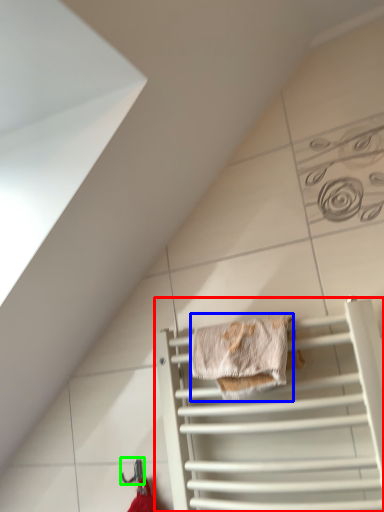
Question: Considering the real-world distances, which object is closest to cage (highlighted by a red box)? material (highlighted by a blue box) or hanger (highlighted by a green box).

Choices:
 (A) material
 (B) hanger

Answer: (A)